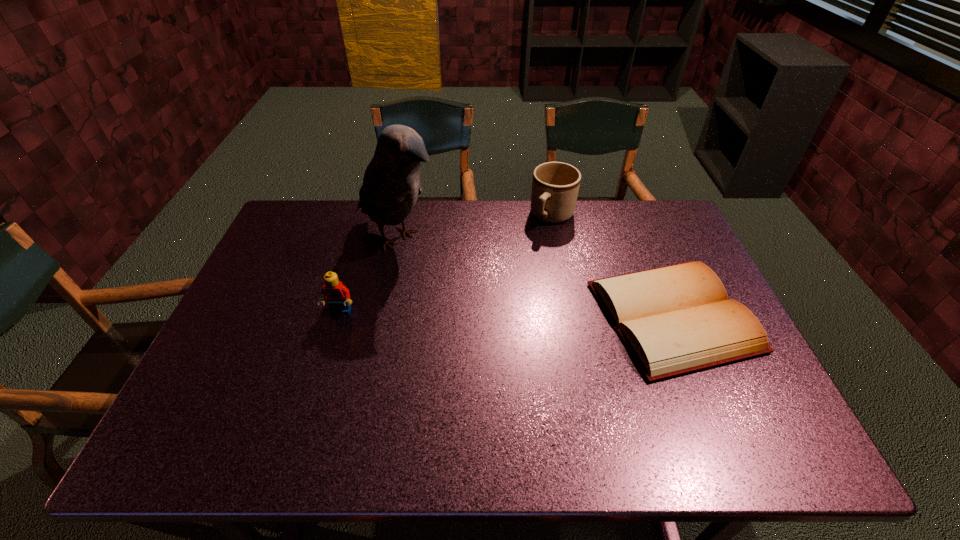
Where is `vacant space located on the side of the mug with the handle`? vacant space located on the side of the mug with the handle is located at coordinates (504, 285).

Find the location of a particular element. This screenshot has height=540, width=960. vacant space situated 0.090m on the side of the mug with the handle is located at coordinates (533, 246).

Locate an element on the screen. parrot at the far edge is located at coordinates (391, 184).

I want to click on mug present at the far edge, so click(x=555, y=185).

Where is `object that is positioned at the near edge`? This screenshot has width=960, height=540. object that is positioned at the near edge is located at coordinates (677, 319).

Find the location of a particular element. object positioned at the right edge is located at coordinates (677, 319).

Image resolution: width=960 pixels, height=540 pixels. In order to click on object positioned at the near right corner in this screenshot , I will do 677,319.

Locate an element on the screen. This screenshot has height=540, width=960. vacant space at the far edge of the desktop is located at coordinates (420, 208).

At what (x,y) coordinates should I click in order to perform the action: click on vacant area at the near edge. Please return your answer as a coordinate pair (x, y). This screenshot has height=540, width=960. Looking at the image, I should click on (508, 402).

This screenshot has height=540, width=960. Identify the location of vacant space at the left edge of the desktop. (301, 254).